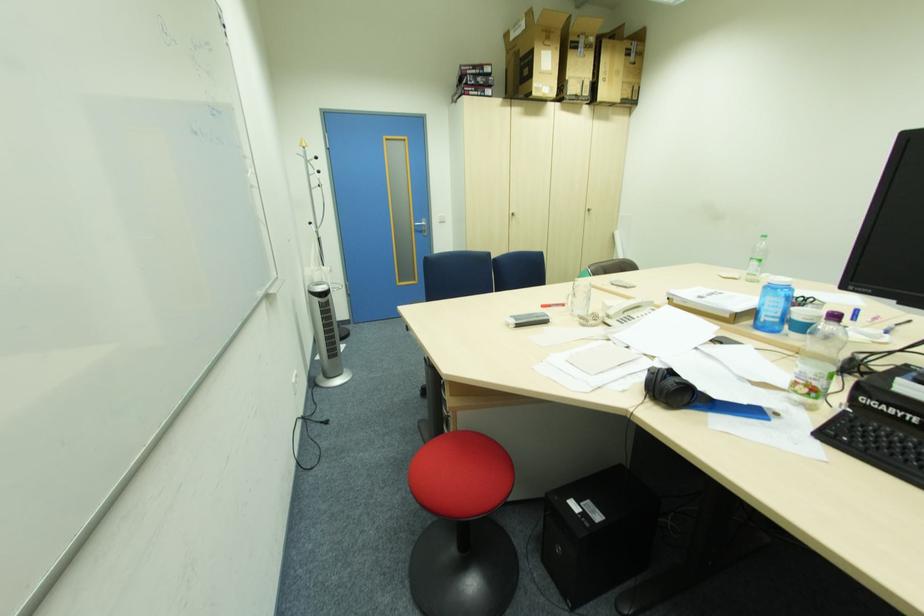
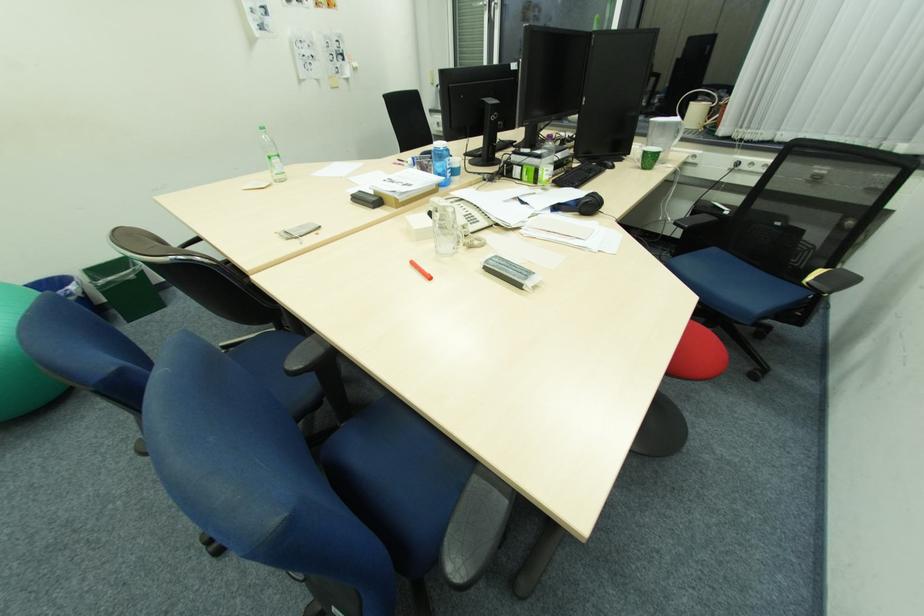
Find the pixel in the second image that matches the point at 758,262 in the first image.

(280, 161)